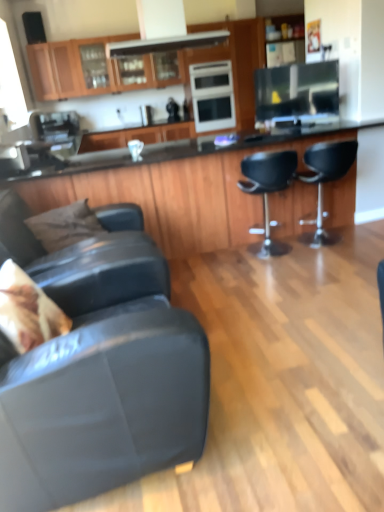
Question: Can you confirm if sleek stainless steel oven at center, the 2th appliance in the right-to-left sequence, is taller than leather couch at lower left, acting as the fourth chair starting from the right?

Choices:
 (A) no
 (B) yes

Answer: (B)

Question: Is sleek stainless steel oven at center, arranged as the 2th appliance when viewed from the front, shorter than leather couch at lower left, acting as the fourth chair starting from the right?

Choices:
 (A) yes
 (B) no

Answer: (B)

Question: Is sleek stainless steel oven at center, the 2th appliance from the bottom, bigger than leather couch at lower left, acting as the fourth chair starting from the right?

Choices:
 (A) no
 (B) yes

Answer: (A)

Question: Is the position of sleek stainless steel oven at center, the 1th appliance when ordered from left to right, more distant than that of leather couch at lower left, acting as the fourth chair starting from the right?

Choices:
 (A) no
 (B) yes

Answer: (B)

Question: Could you tell me if sleek stainless steel oven at center, arranged as the 1th appliance when viewed from the back, is facing leather couch at lower left, positioned as the first chair in left-to-right order?

Choices:
 (A) yes
 (B) no

Answer: (B)

Question: In terms of height, does black leather bar stool at center, marked as the 3th chair in a left-to-right arrangement, look taller or shorter compared to matte black couch at lower left, the second chair from the left?

Choices:
 (A) short
 (B) tall

Answer: (A)

Question: From the image's perspective, relative to matte black couch at lower left, the second chair from the left, is black leather bar stool at center, which appears as the second chair when viewed from the right, above or below?

Choices:
 (A) above
 (B) below

Answer: (A)

Question: Relative to matte black couch at lower left, the second chair from the left, is black leather bar stool at center, marked as the 3th chair in a left-to-right arrangement, in front or behind?

Choices:
 (A) behind
 (B) front

Answer: (A)

Question: Does point (283, 249) appear closer or farther from the camera than point (198, 368)?

Choices:
 (A) closer
 (B) farther

Answer: (B)

Question: From their relative heights in the image, would you say brown fabric pillow at left, positioned as the 2th pillow in bottom-to-top order, is taller or shorter than fluffy beige pillow at lower left, the 2th pillow when ordered from back to front?

Choices:
 (A) tall
 (B) short

Answer: (B)

Question: In terms of size, does brown fabric pillow at left, the first pillow from the top, appear bigger or smaller than fluffy beige pillow at lower left, placed as the 1th pillow when sorted from front to back?

Choices:
 (A) big
 (B) small

Answer: (B)

Question: Considering their positions, is brown fabric pillow at left, which is counted as the first pillow, starting from the back, located in front of or behind fluffy beige pillow at lower left, the 2th pillow when ordered from back to front?

Choices:
 (A) behind
 (B) front

Answer: (A)

Question: From the image's perspective, relative to fluffy beige pillow at lower left, the 2th pillow when ordered from back to front, is brown fabric pillow at left, positioned as the 2th pillow in bottom-to-top order, above or below?

Choices:
 (A) below
 (B) above

Answer: (B)

Question: Considering the positions of brown fabric pillow at left, which is counted as the first pillow, starting from the back, and leather couch at lower left, acting as the fourth chair starting from the right, in the image, is brown fabric pillow at left, which is counted as the first pillow, starting from the back, taller or shorter than leather couch at lower left, acting as the fourth chair starting from the right,?

Choices:
 (A) tall
 (B) short

Answer: (B)

Question: Looking at the image, does brown fabric pillow at left, acting as the second pillow starting from the front, seem bigger or smaller compared to leather couch at lower left, acting as the fourth chair starting from the right?

Choices:
 (A) big
 (B) small

Answer: (B)